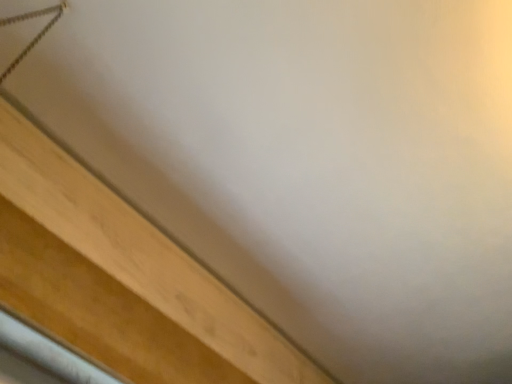
The height and width of the screenshot is (384, 512). I want to click on metallic rope at upper left, so click(x=36, y=35).

The image size is (512, 384). What do you see at coordinates (36, 35) in the screenshot?
I see `metallic rope at upper left` at bounding box center [36, 35].

Measure the distance between metallic rope at upper left and camera.

78.43 centimeters.

What do you see at coordinates (120, 279) in the screenshot?
I see `light wood plank at lower left` at bounding box center [120, 279].

You are a GUI agent. You are given a task and a screenshot of the screen. Output one action in this format:
    pyautogui.click(x=<x>, y=<y>)
    Task: Click on the light wood plank at lower left
    
    Given the screenshot: What is the action you would take?
    pyautogui.click(x=120, y=279)

What is the approximate height of light wood plank at lower left?

The height of light wood plank at lower left is 23.80 centimeters.

This screenshot has height=384, width=512. Find the location of `metallic rope at upper left`. metallic rope at upper left is located at coordinates (36, 35).

Considering the positions of objects metallic rope at upper left and light wood plank at lower left in the image provided, who is more to the left, metallic rope at upper left or light wood plank at lower left?

From the viewer's perspective, metallic rope at upper left appears more on the left side.

Is metallic rope at upper left positioned before light wood plank at lower left?

Yes.

In the scene shown: Which is less distant, [17,20] or [131,318]?

Point [17,20] appears to be closer to the viewer than point [131,318].

From the image's perspective, between metallic rope at upper left and light wood plank at lower left, which one is located above?

metallic rope at upper left is shown above in the image.

From a real-world perspective, is metallic rope at upper left above or below light wood plank at lower left?

From a real-world perspective, metallic rope at upper left is physically above light wood plank at lower left.

From the picture: Which of these two, metallic rope at upper left or light wood plank at lower left, is thinner?

With smaller width is light wood plank at lower left.

Considering the sizes of objects metallic rope at upper left and light wood plank at lower left in the image provided, who is taller, metallic rope at upper left or light wood plank at lower left?

With more height is metallic rope at upper left.

Which of these two, metallic rope at upper left or light wood plank at lower left, is smaller?

metallic rope at upper left.

Is metallic rope at upper left inside or outside of light wood plank at lower left?

metallic rope at upper left cannot be found inside light wood plank at lower left.

Based on the photo, is metallic rope at upper left not close to light wood plank at lower left?

Actually, metallic rope at upper left and light wood plank at lower left are a little close together.

Could you tell me if metallic rope at upper left is facing light wood plank at lower left?

No, metallic rope at upper left does not turn towards light wood plank at lower left.

Measure the distance from metallic rope at upper left to light wood plank at lower left.

metallic rope at upper left is 19.01 inches from light wood plank at lower left.

Where is `twin located in front of the light wood plank at lower left`? This screenshot has width=512, height=384. twin located in front of the light wood plank at lower left is located at coordinates (36, 35).

Considering the relative positions of light wood plank at lower left and metallic rope at upper left in the image provided, is light wood plank at lower left to the right of metallic rope at upper left from the viewer's perspective?

Correct, you'll find light wood plank at lower left to the right of metallic rope at upper left.

Is light wood plank at lower left positioned before metallic rope at upper left?

No, light wood plank at lower left is behind metallic rope at upper left.

Does point (212, 288) come behind point (38, 41)?

That is True.

From the image's perspective, which one is positioned higher, light wood plank at lower left or metallic rope at upper left?

From the image's view, metallic rope at upper left is above.

Looking at this image, from a real-world perspective, which is physically below, light wood plank at lower left or metallic rope at upper left?

light wood plank at lower left.

Between light wood plank at lower left and metallic rope at upper left, which one has smaller width?

With smaller width is light wood plank at lower left.

From their relative heights in the image, would you say light wood plank at lower left is taller or shorter than metallic rope at upper left?

light wood plank at lower left is shorter than metallic rope at upper left.

Looking at the image, does light wood plank at lower left seem bigger or smaller compared to metallic rope at upper left?

Considering their sizes, light wood plank at lower left takes up more space than metallic rope at upper left.

Is light wood plank at lower left completely or partially outside of metallic rope at upper left?

Absolutely, light wood plank at lower left is external to metallic rope at upper left.

Is light wood plank at lower left next to metallic rope at upper left?

There is a gap between light wood plank at lower left and metallic rope at upper left.

Is light wood plank at lower left turned away from metallic rope at upper left?

No, metallic rope at upper left is not at the back of light wood plank at lower left.

Can you tell me how much light wood plank at lower left and metallic rope at upper left differ in facing direction?

65.9 degrees.

This screenshot has height=384, width=512. Find the location of `twin above the light wood plank at lower left (from the image's perspective)`. twin above the light wood plank at lower left (from the image's perspective) is located at coordinates [36, 35].

This screenshot has width=512, height=384. Identify the location of twin on the left of light wood plank at lower left. (36, 35).

At what (x,y) coordinates should I click in order to perform the action: click on furniture lying below the metallic rope at upper left (from the image's perspective). Please return your answer as a coordinate pair (x, y). Looking at the image, I should click on (120, 279).